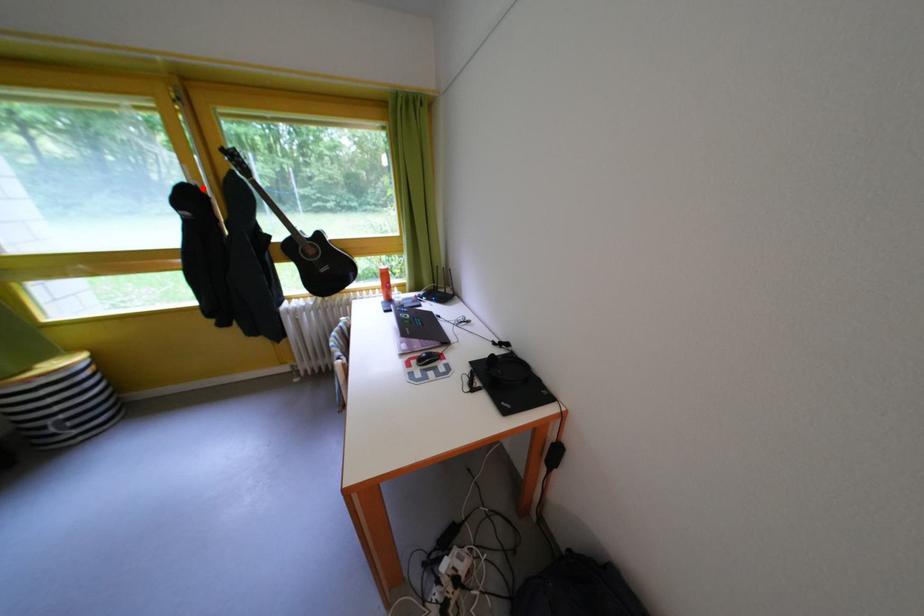
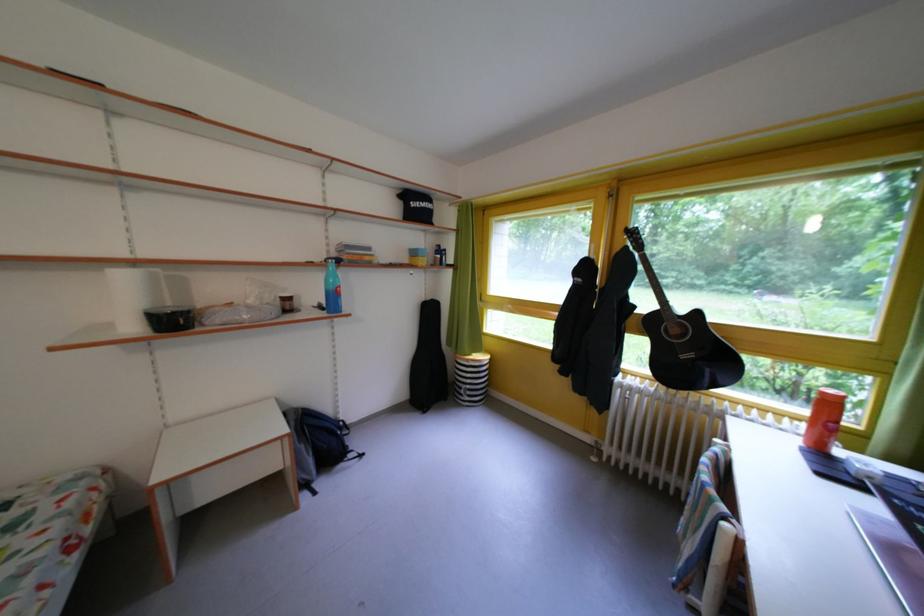
In the second image, find the point that corresponds to the highlighted location in the first image.

(602, 262)